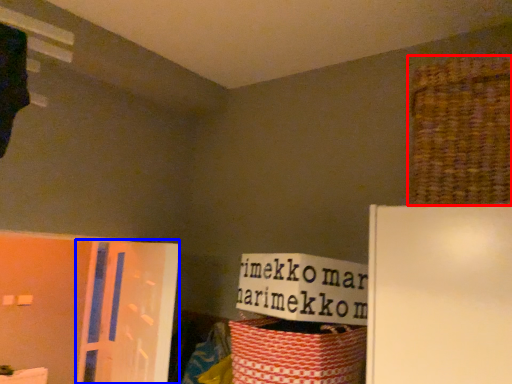
Question: Which object appears farthest to the camera in this image, basket (highlighted by a red box) or screen door (highlighted by a blue box)?

Choices:
 (A) basket
 (B) screen door

Answer: (B)